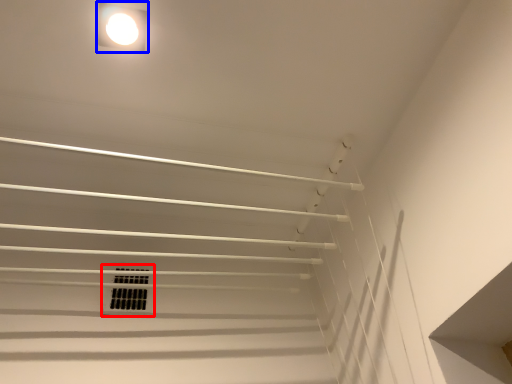
Question: Which point is further to the camera, window (highlighted by a red box) or lamp (highlighted by a blue box)?

Choices:
 (A) window
 (B) lamp

Answer: (A)